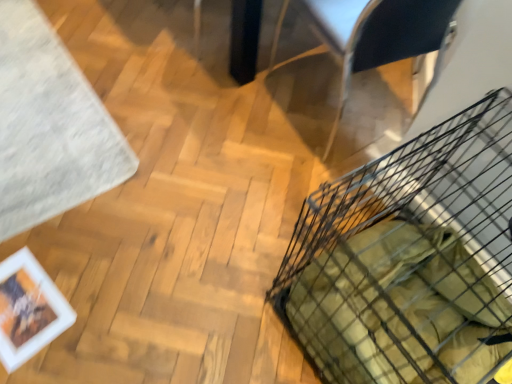
Find the location of a particular element. The height and width of the screenshot is (384, 512). free point below white matte picture frame at lower left (from a real-world perspective) is located at coordinates (23, 303).